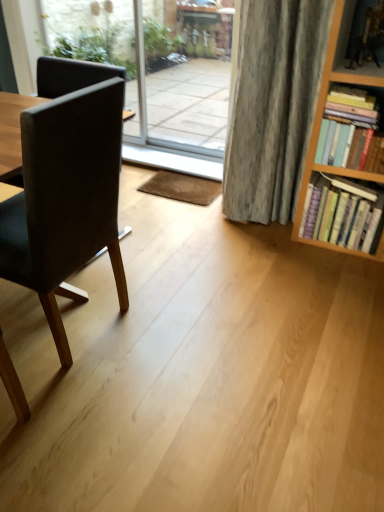
The width and height of the screenshot is (384, 512). In order to click on free space in front of hardcover books at right, arranged as the first book when ordered from the bottom in this screenshot , I will do `click(335, 263)`.